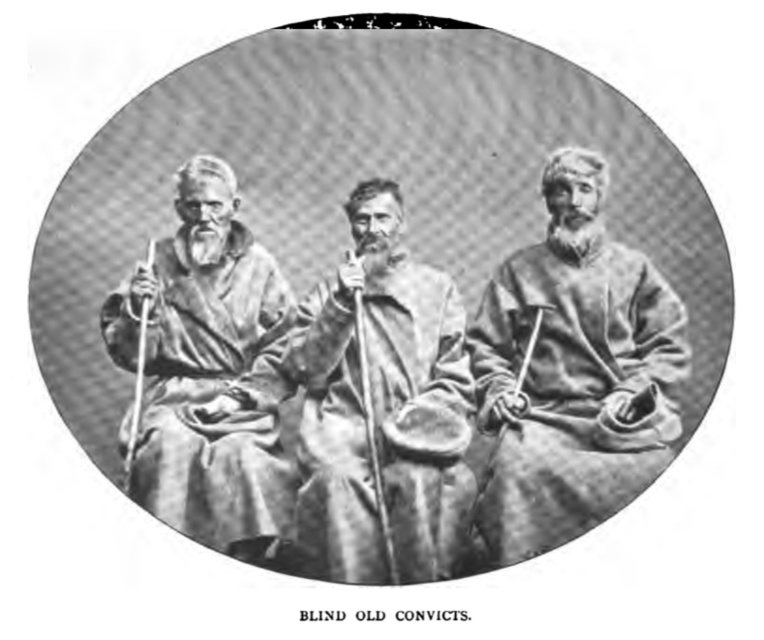
You are a tailor who needs to determine if the smooth wooden stick at center can fit inside the smooth woolen robe at center. Based on the provided scene, can you confirm if the stick will fit inside the robe?

The smooth woolen robe at center is wider than the smooth wooden stick at center, so the stick can fit inside the robe.

You are a photographer who wants to take a closeup shot of the smooth woolen robe at center and the smooth wooden stick at center. Your camera has a maximum focus range of 3 meters. Can you capture both objects in one shot without moving the camera?

The smooth woolen robe at center is 3.19 meters away from the smooth wooden stick at center. Since the distance between them exceeds the camera maximum focus range of 3 meters, you cannot capture both objects in one shot without moving the camera.